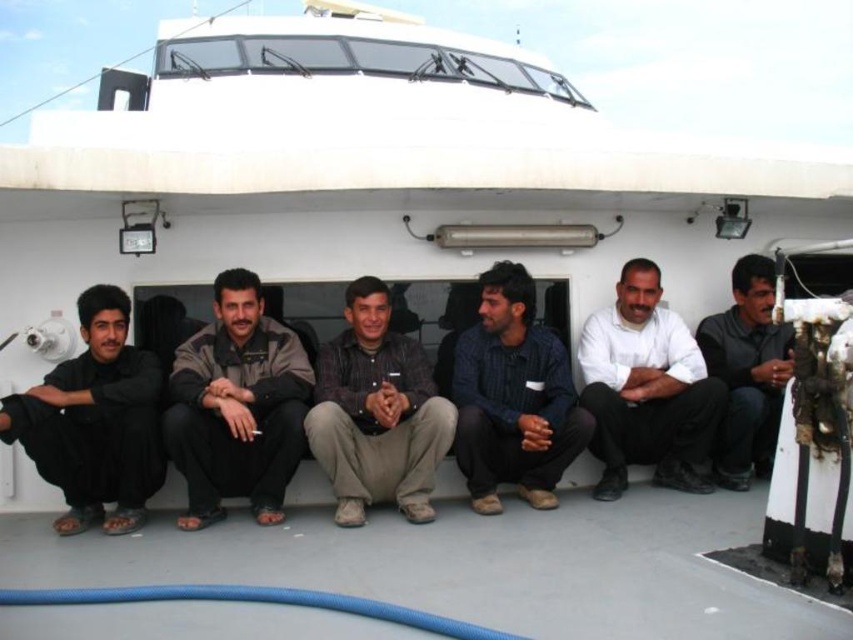
Question: Which object appears closest to the camera in this image?

Choices:
 (A) brown textured shirt at center
 (B) white matte shirt at center
 (C) black matte pants at left
 (D) brown leather jacket at center

Answer: (C)

Question: Observing the image, what is the correct spatial positioning of dark blue shirt at center in reference to black matte shirt at center?

Choices:
 (A) below
 (B) above

Answer: (A)

Question: Based on their relative distances, which object is nearer to the brown textured shirt at center?

Choices:
 (A) white matte shirt at center
 (B) dark blue shirt at center

Answer: (B)

Question: Which of these objects is positioned closest to the brown textured shirt at center?

Choices:
 (A) brown leather jacket at center
 (B) black matte pants at left

Answer: (A)

Question: Is white matte shirt at center bigger than black matte shirt at center?

Choices:
 (A) no
 (B) yes

Answer: (B)

Question: Does brown leather jacket at center lie in front of black matte shirt at center?

Choices:
 (A) yes
 (B) no

Answer: (A)